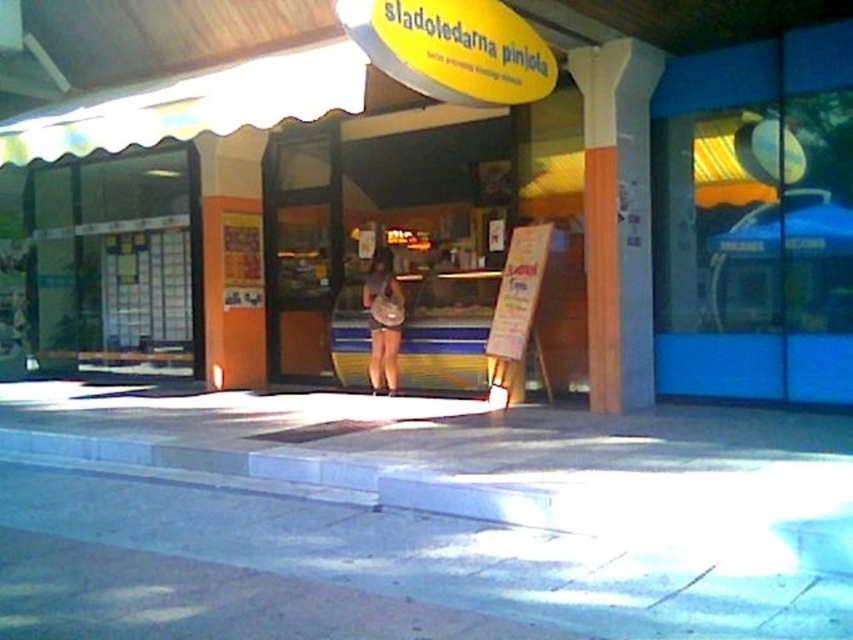
Question: Can you confirm if gray concrete pavement at center is thinner than wooden post at center?

Choices:
 (A) no
 (B) yes

Answer: (B)

Question: Which point is closer to the camera?

Choices:
 (A) (387, 330)
 (B) (750, 618)
 (C) (395, 97)
 (D) (527, 264)

Answer: (B)

Question: Is wooden sign at center wider than matte brown purse at center?

Choices:
 (A) no
 (B) yes

Answer: (B)

Question: Which point is farther to the camera?

Choices:
 (A) (637, 168)
 (B) (268, 131)
 (C) (393, 298)
 (D) (483, 588)

Answer: (B)

Question: Which of the following is the closest to the observer?

Choices:
 (A) matte brown purse at center
 (B) gray concrete pavement at center
 (C) wooden post at center
 (D) wooden sign at center

Answer: (B)

Question: Does matte yellow awning at center have a smaller size compared to gray concrete pavement at center?

Choices:
 (A) no
 (B) yes

Answer: (A)